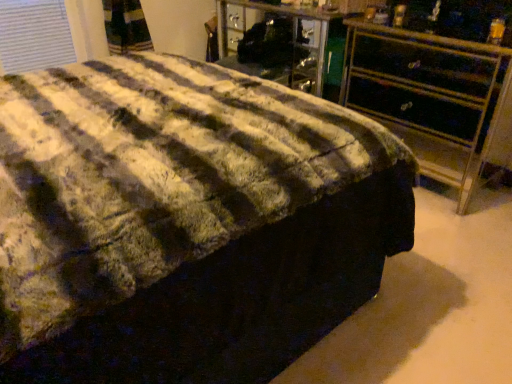
Question: In the image, is metallic gold chest of drawers at right positioned in front of or behind fluffy fabric bed at center?

Choices:
 (A) behind
 (B) front

Answer: (A)

Question: Is metallic gold chest of drawers at right wider or thinner than fluffy fabric bed at center?

Choices:
 (A) thin
 (B) wide

Answer: (A)

Question: Considering the positions of metallic gold chest of drawers at right and fluffy fabric bed at center in the image, is metallic gold chest of drawers at right taller or shorter than fluffy fabric bed at center?

Choices:
 (A) short
 (B) tall

Answer: (A)

Question: Considering the positions of fluffy fabric bed at center and metallic gold chest of drawers at right in the image, is fluffy fabric bed at center wider or thinner than metallic gold chest of drawers at right?

Choices:
 (A) thin
 (B) wide

Answer: (B)

Question: Looking at the image, does fluffy fabric bed at center seem bigger or smaller compared to metallic gold chest of drawers at right?

Choices:
 (A) big
 (B) small

Answer: (A)

Question: Considering the positions of point (144, 369) and point (355, 57), is point (144, 369) closer or farther from the camera than point (355, 57)?

Choices:
 (A) closer
 (B) farther

Answer: (A)

Question: In terms of height, does fluffy fabric bed at center look taller or shorter compared to metallic gold chest of drawers at right?

Choices:
 (A) tall
 (B) short

Answer: (A)